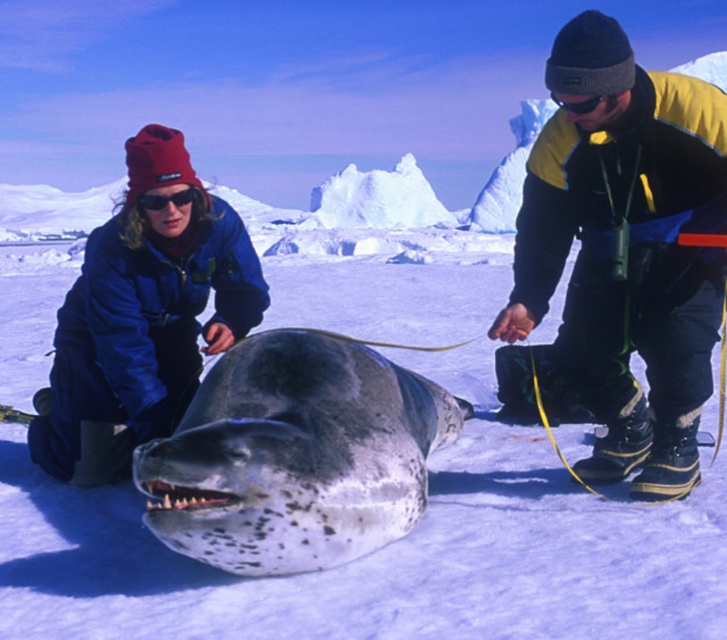
Does black fleece jacket at center appear on the right side of speckled gray whale at center?

Indeed, black fleece jacket at center is positioned on the right side of speckled gray whale at center.

Describe the element at coordinates (624, 250) in the screenshot. This screenshot has height=640, width=727. I see `black fleece jacket at center` at that location.

The height and width of the screenshot is (640, 727). Identify the location of black fleece jacket at center. (624, 250).

Who is more distant from viewer, (554, 365) or (103, 429)?

The point (554, 365) is more distant.

The height and width of the screenshot is (640, 727). In order to click on black fleece jacket at center in this screenshot , I will do `click(624, 250)`.

Locate an element on the screen. The height and width of the screenshot is (640, 727). black fleece jacket at center is located at coordinates (624, 250).

Who is shorter, speckled gray whale at center or blue fleece jacket at center?

speckled gray whale at center

Describe the element at coordinates (294, 456) in the screenshot. I see `speckled gray whale at center` at that location.

What do you see at coordinates (294, 456) in the screenshot?
I see `speckled gray whale at center` at bounding box center [294, 456].

The width and height of the screenshot is (727, 640). In order to click on speckled gray whale at center in this screenshot , I will do `click(294, 456)`.